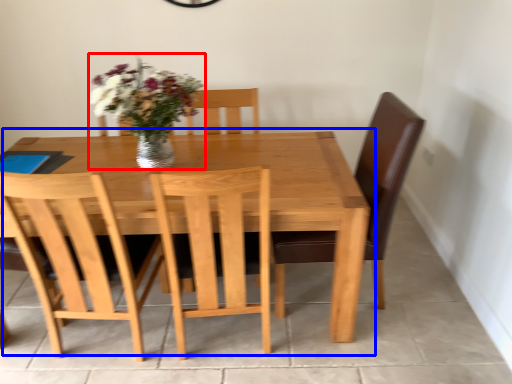
Question: Which of the following is the closest to the observer, floral arrangement (highlighted by a red box) or kitchen & dining room table (highlighted by a blue box)?

Choices:
 (A) floral arrangement
 (B) kitchen & dining room table

Answer: (A)